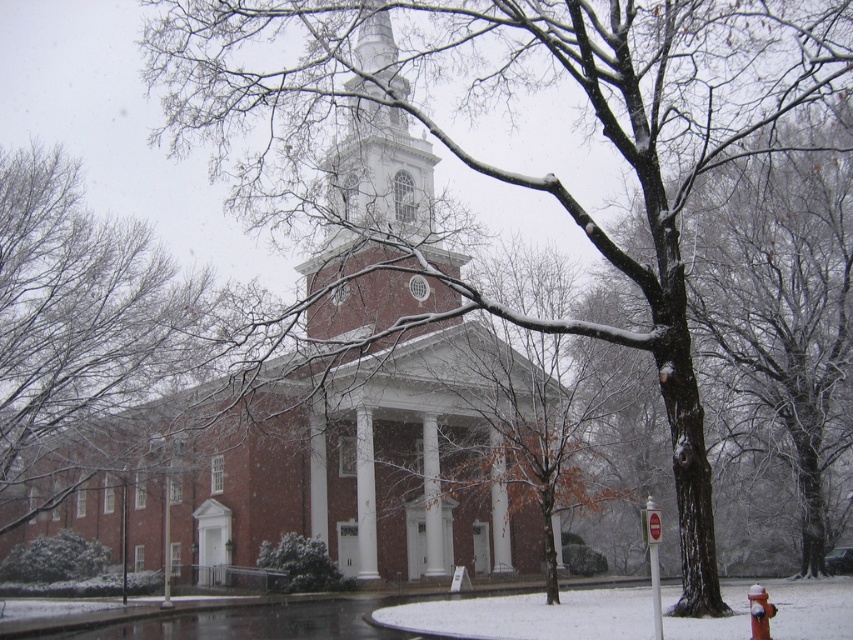
Between brick building at center and white textured steeple at center, which one has less height?

white textured steeple at center

At what (x,y) coordinates should I click in order to perform the action: click on brick building at center. Please return your answer as a coordinate pair (x, y). The width and height of the screenshot is (853, 640). Looking at the image, I should click on (317, 461).

This screenshot has width=853, height=640. I want to click on brick building at center, so click(x=317, y=461).

Does white textured steeple at center have a greater height compared to snow-covered fire hydrant at lower right?

Indeed, white textured steeple at center has a greater height compared to snow-covered fire hydrant at lower right.

Is white textured steeple at center positioned behind snow-covered fire hydrant at lower right?

Yes.

The height and width of the screenshot is (640, 853). Identify the location of white textured steeple at center. (380, 147).

Measure the distance from brick building at center to snow-covered fire hydrant at lower right.

brick building at center is 163.55 feet away from snow-covered fire hydrant at lower right.

Measure the distance from brick building at center to snow-covered fire hydrant at lower right.

49.85 meters

Which is in front, point (437, 540) or point (747, 598)?

Point (747, 598)

Find the location of a particular element. The height and width of the screenshot is (640, 853). brick building at center is located at coordinates (317, 461).